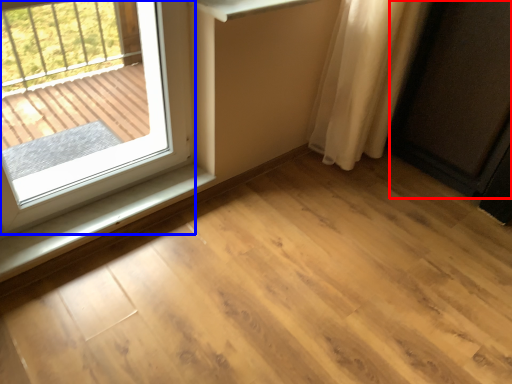
Question: Among these objects, which one is farthest to the camera, screen door (highlighted by a red box) or window (highlighted by a blue box)?

Choices:
 (A) screen door
 (B) window

Answer: (A)